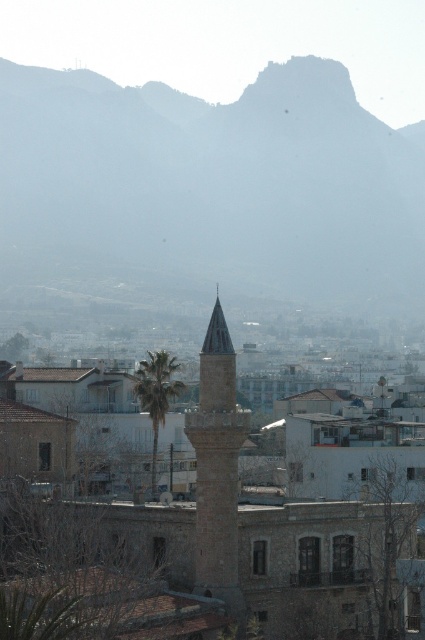
Between point (209, 406) and point (141, 392), which one is positioned in front?

Point (209, 406)

Does smooth stone minaret at center have a greater width compared to green leafy palm at center?

In fact, smooth stone minaret at center might be narrower than green leafy palm at center.

The height and width of the screenshot is (640, 425). What are the coordinates of `smooth stone minaret at center` in the screenshot? It's located at (217, 465).

Identify the location of smooth stone minaret at center. (217, 465).

Looking at this image, who is taller, gray rocky mountain at upper center or green leafy palm at center?

Standing taller between the two is gray rocky mountain at upper center.

Is point (42, 177) behind point (158, 355)?

That is True.

Between point (272, 147) and point (155, 372), which one is positioned in front?

Point (155, 372) is more forward.

This screenshot has height=640, width=425. Find the location of `gray rocky mountain at upper center`. gray rocky mountain at upper center is located at coordinates (218, 182).

Is gray rocky mountain at upper center to the right of smooth stone minaret at center from the viewer's perspective?

No, gray rocky mountain at upper center is not to the right of smooth stone minaret at center.

Can you confirm if gray rocky mountain at upper center is taller than smooth stone minaret at center?

Correct, gray rocky mountain at upper center is much taller as smooth stone minaret at center.

The height and width of the screenshot is (640, 425). What are the coordinates of `gray rocky mountain at upper center` in the screenshot? It's located at (218, 182).